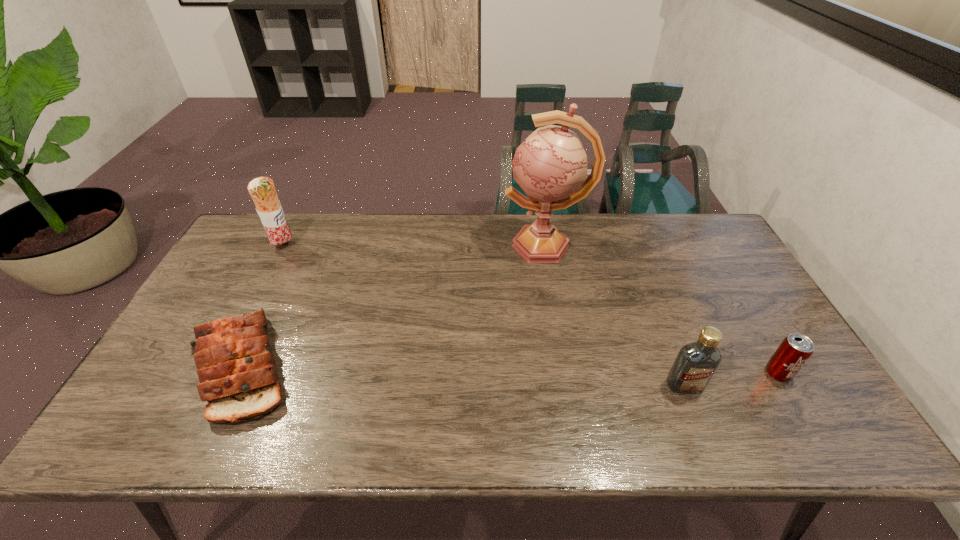
This screenshot has height=540, width=960. I want to click on free space that satisfies the following two spatial constraints: 1. on the back side of the beer can; 2. on the front-facing side of the globe, so click(x=703, y=246).

Locate an element on the screen. free space that satisfies the following two spatial constraints: 1. on the front-facing side of the tallest object; 2. on the front side of the bread is located at coordinates (565, 366).